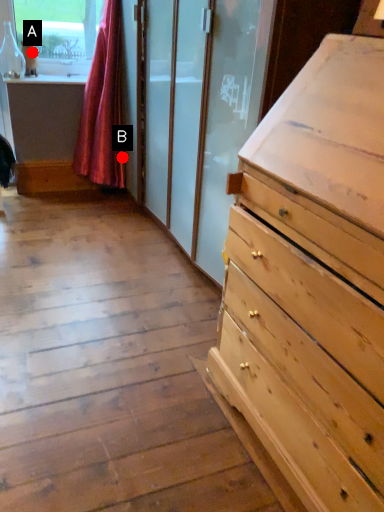
Question: Two points are circled on the image, labeled by A and B beside each circle. Which point is closer to the camera?

Choices:
 (A) A is closer
 (B) B is closer

Answer: (A)